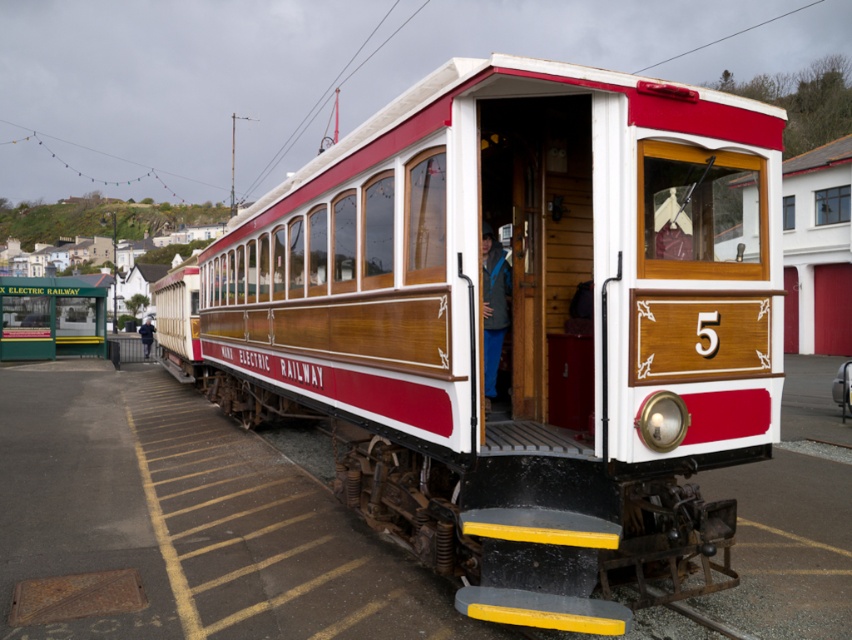
From the picture: You are a passenger waiting at the platform. You need to board the wooden panel train at center, but you are currently standing near the dark blue jacket at center. Can you walk directly to the train without moving around other passengers?

The wooden panel train at center is wider than the dark blue jacket at center, so yes, you can walk directly to the train since there is enough space between them.

Looking at this image, you are a passenger waiting at the X ELECTRIC RAILWAY platform. You notice a person wearing blue denim pants at center and dark blue jacket at center. Which clothing item is visible on top?

The blue denim pants at center is positioned over dark blue jacket at center, so the blue denim pants at center is visible on top.